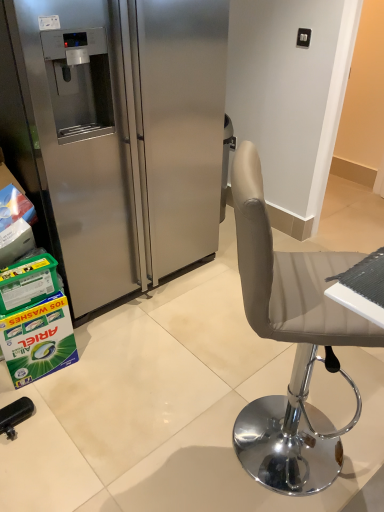
The image size is (384, 512). What do you see at coordinates (38, 340) in the screenshot? I see `green cardboard box at lower left, the first box when ordered from bottom to top` at bounding box center [38, 340].

This screenshot has width=384, height=512. What do you see at coordinates (124, 135) in the screenshot?
I see `stainless steel refrigerator at left` at bounding box center [124, 135].

You are a GUI agent. You are given a task and a screenshot of the screen. Output one action in this format:
    pyautogui.click(x=<x>, y=<y>)
    Task: Click on the stainless steel refrigerator at left
    
    Given the screenshot: What is the action you would take?
    pyautogui.click(x=124, y=135)

Locate an element on the screen. The width and height of the screenshot is (384, 512). green cardboard box at lower left, which ranks as the second box in top-to-bottom order is located at coordinates (38, 340).

Considering the relative positions of green plastic container at lower left, the first box positioned from the top, and stainless steel refrigerator at left in the image provided, is green plastic container at lower left, the first box positioned from the top, behind stainless steel refrigerator at left?

Yes, it is.

Do you think green plastic container at lower left, the second box in the bottom-to-top sequence, is within stainless steel refrigerator at left, or outside of it?

green plastic container at lower left, the second box in the bottom-to-top sequence, is outside stainless steel refrigerator at left.

Does green plastic container at lower left, the first box positioned from the top, appear on the left side of stainless steel refrigerator at left?

Correct, you'll find green plastic container at lower left, the first box positioned from the top, to the left of stainless steel refrigerator at left.

From a real-world perspective, between green plastic container at lower left, the second box in the bottom-to-top sequence, and stainless steel refrigerator at left, who is vertically lower?

green plastic container at lower left, the second box in the bottom-to-top sequence.

Would you say green plastic container at lower left, the second box in the bottom-to-top sequence, is inside or outside green cardboard box at lower left, which ranks as the second box in top-to-bottom order?

green plastic container at lower left, the second box in the bottom-to-top sequence, is not enclosed by green cardboard box at lower left, which ranks as the second box in top-to-bottom order.

Does green plastic container at lower left, the second box in the bottom-to-top sequence, turn towards green cardboard box at lower left, which ranks as the second box in top-to-bottom order?

No, green plastic container at lower left, the second box in the bottom-to-top sequence, is not oriented towards green cardboard box at lower left, which ranks as the second box in top-to-bottom order.

Is the position of green plastic container at lower left, the second box in the bottom-to-top sequence, less distant than that of green cardboard box at lower left, the first box when ordered from bottom to top?

Yes, green plastic container at lower left, the second box in the bottom-to-top sequence, is closer to the viewer.

From a real-world perspective, between green plastic container at lower left, the second box in the bottom-to-top sequence, and green cardboard box at lower left, the first box when ordered from bottom to top, who is vertically lower?

In real-world perspective, green cardboard box at lower left, the first box when ordered from bottom to top, is lower.

Are green cardboard box at lower left, which ranks as the second box in top-to-bottom order, and stainless steel refrigerator at left far apart?

No, green cardboard box at lower left, which ranks as the second box in top-to-bottom order, is not far away from stainless steel refrigerator at left.

Can you confirm if green cardboard box at lower left, which ranks as the second box in top-to-bottom order, is bigger than stainless steel refrigerator at left?

No.

From a real-world perspective, which is physically above, green cardboard box at lower left, which ranks as the second box in top-to-bottom order, or stainless steel refrigerator at left?

stainless steel refrigerator at left.

Is green cardboard box at lower left, which ranks as the second box in top-to-bottom order, turned away from stainless steel refrigerator at left?

green cardboard box at lower left, which ranks as the second box in top-to-bottom order, does not have its back to stainless steel refrigerator at left.

Considering the points (53, 89) and (25, 314), which point is in front, point (53, 89) or point (25, 314)?

The point (53, 89) is more forward.

Is stainless steel refrigerator at left positioned with its back to green cardboard box at lower left, the first box when ordered from bottom to top?

That's not correct — stainless steel refrigerator at left is not looking away from green cardboard box at lower left, the first box when ordered from bottom to top.

Is there a large distance between stainless steel refrigerator at left and green cardboard box at lower left, the first box when ordered from bottom to top?

stainless steel refrigerator at left is actually quite close to green cardboard box at lower left, the first box when ordered from bottom to top.

Can you tell me how much stainless steel refrigerator at left and green cardboard box at lower left, the first box when ordered from bottom to top, differ in facing direction?

The angular difference between stainless steel refrigerator at left and green cardboard box at lower left, the first box when ordered from bottom to top, is 6.51 degrees.

In the scene shown: Measure the distance from green cardboard box at lower left, which ranks as the second box in top-to-bottom order, to green plastic container at lower left, the first box positioned from the top.

They are 6.16 inches apart.

Which of these two, green cardboard box at lower left, which ranks as the second box in top-to-bottom order, or green plastic container at lower left, the second box in the bottom-to-top sequence, is thinner?

green cardboard box at lower left, which ranks as the second box in top-to-bottom order, is thinner.

Image resolution: width=384 pixels, height=512 pixels. I want to click on box lying behind the green plastic container at lower left, the first box positioned from the top, so click(x=38, y=340).

Which object is further away from the camera taking this photo, green cardboard box at lower left, which ranks as the second box in top-to-bottom order, or green plastic container at lower left, the second box in the bottom-to-top sequence?

green cardboard box at lower left, which ranks as the second box in top-to-bottom order, is further from the camera.

Is stainless steel refrigerator at left next to green plastic container at lower left, the second box in the bottom-to-top sequence, and touching it?

No, stainless steel refrigerator at left is not next to green plastic container at lower left, the second box in the bottom-to-top sequence.

This screenshot has height=512, width=384. Identify the location of refrigerator in front of the green plastic container at lower left, the first box positioned from the top. (124, 135).

How much distance is there between stainless steel refrigerator at left and green plastic container at lower left, the second box in the bottom-to-top sequence?

23.27 inches.

Considering the relative positions of stainless steel refrigerator at left and green plastic container at lower left, the first box positioned from the top, in the image provided, is stainless steel refrigerator at left in front of green plastic container at lower left, the first box positioned from the top,?

Yes, stainless steel refrigerator at left is closer to the viewer.

Locate an element on the screen. refrigerator lying in front of the green plastic container at lower left, the second box in the bottom-to-top sequence is located at coordinates (124, 135).

Locate an element on the screen. The width and height of the screenshot is (384, 512). box lying on the left of green plastic container at lower left, the second box in the bottom-to-top sequence is located at coordinates (38, 340).

From the image, which object appears to be nearer to stainless steel refrigerator at left, green plastic container at lower left, the second box in the bottom-to-top sequence, or green cardboard box at lower left, which ranks as the second box in top-to-bottom order?

Based on the image, green cardboard box at lower left, which ranks as the second box in top-to-bottom order, appears to be nearer to stainless steel refrigerator at left.

Looking at the image, which one is located closer to green cardboard box at lower left, which ranks as the second box in top-to-bottom order, stainless steel refrigerator at left or green plastic container at lower left, the first box positioned from the top?

Among the two, green plastic container at lower left, the first box positioned from the top, is located nearer to green cardboard box at lower left, which ranks as the second box in top-to-bottom order.

Considering their positions, is green plastic container at lower left, the second box in the bottom-to-top sequence, positioned closer to green cardboard box at lower left, the first box when ordered from bottom to top, than stainless steel refrigerator at left?

green plastic container at lower left, the second box in the bottom-to-top sequence.

From the image, which object appears to be farther from green plastic container at lower left, the first box positioned from the top, stainless steel refrigerator at left or green cardboard box at lower left, the first box when ordered from bottom to top?

stainless steel refrigerator at left is positioned further to the anchor green plastic container at lower left, the first box positioned from the top.

From the picture: From the image, which object appears to be farther from stainless steel refrigerator at left, green cardboard box at lower left, which ranks as the second box in top-to-bottom order, or green plastic container at lower left, the second box in the bottom-to-top sequence?

green plastic container at lower left, the second box in the bottom-to-top sequence, is positioned further to the anchor stainless steel refrigerator at left.

Estimate the real-world distances between objects in this image. Which object is further from green plastic container at lower left, the second box in the bottom-to-top sequence, green cardboard box at lower left, which ranks as the second box in top-to-bottom order, or stainless steel refrigerator at left?

The object further to green plastic container at lower left, the second box in the bottom-to-top sequence, is stainless steel refrigerator at left.

Locate an element on the screen. Image resolution: width=384 pixels, height=512 pixels. box between stainless steel refrigerator at left and green cardboard box at lower left, the first box when ordered from bottom to top, in the vertical direction is located at coordinates (27, 282).